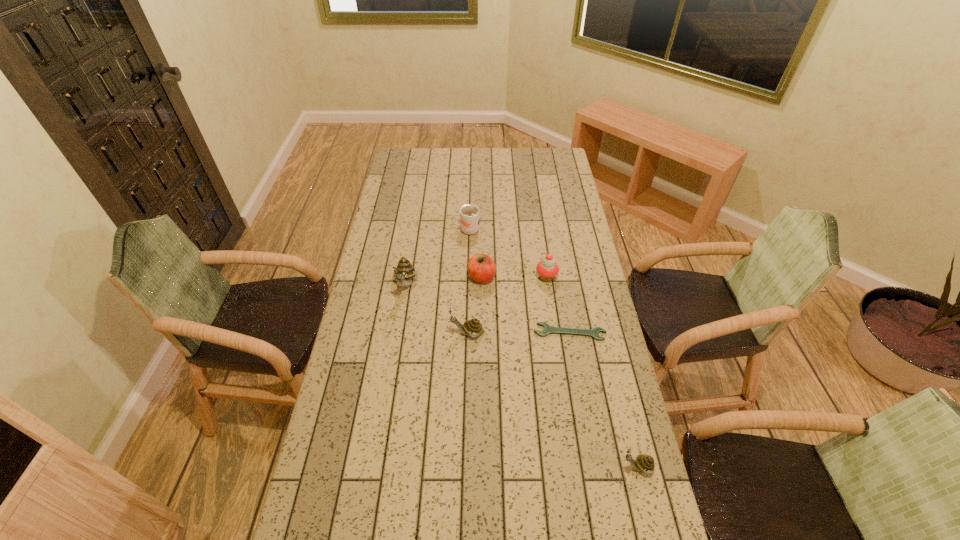
The image size is (960, 540). Identify the location of object that is the third closest one to the nearest object. pyautogui.click(x=547, y=269).

Identify which object is the fifth nearest to the wrench. Please provide its 2D coordinates. Your answer should be formatted as a tuple, i.e. [(x, y)], where the tuple contains the x and y coordinates of a point satisfying the conditions above.

[(404, 271)]

The height and width of the screenshot is (540, 960). Find the location of `the closest snail to the shortest object`. the closest snail to the shortest object is located at coordinates (473, 327).

Identify the location of the third closest snail to the cup. This screenshot has height=540, width=960. (645, 463).

Image resolution: width=960 pixels, height=540 pixels. What are the coordinates of `vacant space that satisfies the following two spatial constraints: 1. on the front side of the cupcake; 2. on the right side of the shortest object` in the screenshot? It's located at (555, 332).

Where is `free space that satisfies the following two spatial constraints: 1. on the front side of the wrench; 2. on the left side of the apple`? This screenshot has height=540, width=960. free space that satisfies the following two spatial constraints: 1. on the front side of the wrench; 2. on the left side of the apple is located at coordinates (482, 332).

Image resolution: width=960 pixels, height=540 pixels. I want to click on free space in the image that satisfies the following two spatial constraints: 1. on the front side of the cupcake; 2. on the face of the second shortest snail, so click(555, 333).